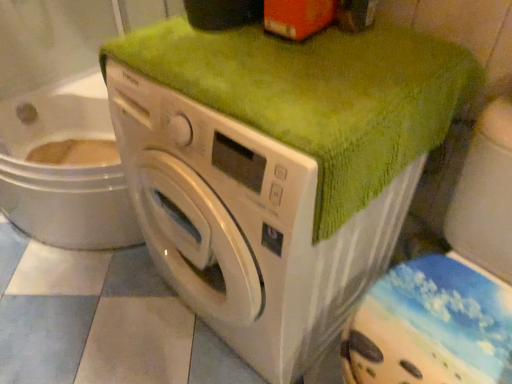
Identify the location of free space above white glossy washing machine at center (from a real-world perspective). (289, 72).